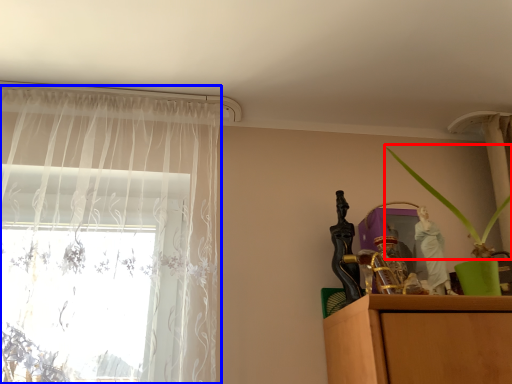
Question: Which object appears farthest to the camera in this image, plant (highlighted by a red box) or curtain (highlighted by a blue box)?

Choices:
 (A) plant
 (B) curtain

Answer: (B)